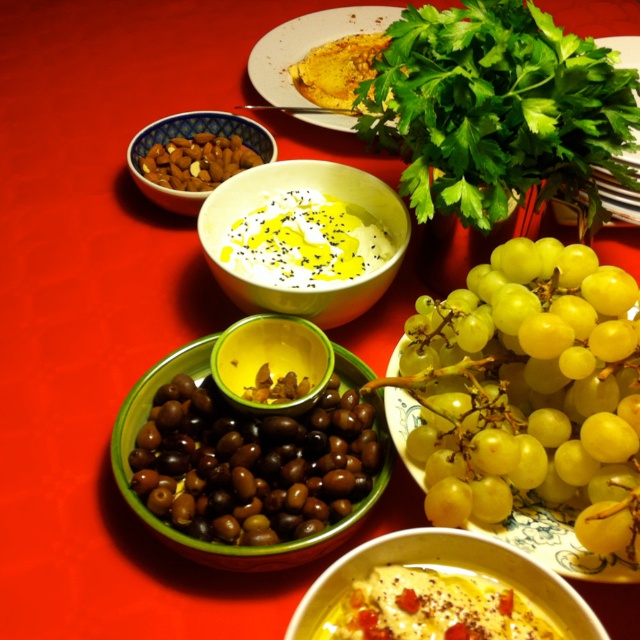
You are a food stylist arranging items on a table. You have a green matte olives at center and a yellow creamy soup at center. Which of these two items is taller when placed side by side?

The yellow creamy soup at center is taller than the green matte olives at center.

Consider the image. You are a food stylist arranging items on a table. You have a green matte olives at center and a yellow creamy soup at center. According to the scene, which item is positioned higher on the table?

The yellow creamy soup at center is positioned higher on the table than the green matte olives at center because the green matte olives at center is located below it.